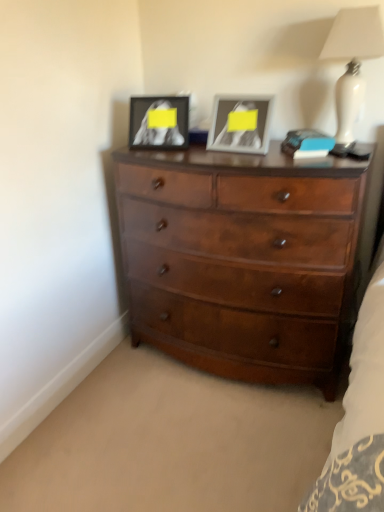
Question: Is matte black picture frame at upper center, placed as the second picture frame when sorted from right to left, to the left of blue matte book at upper right from the viewer's perspective?

Choices:
 (A) no
 (B) yes

Answer: (B)

Question: Can you confirm if matte black picture frame at upper center, placed as the second picture frame when sorted from right to left, is thinner than blue matte book at upper right?

Choices:
 (A) no
 (B) yes

Answer: (B)

Question: Is matte black picture frame at upper center, the 1th picture frame viewed from the left, positioned beyond the bounds of blue matte book at upper right?

Choices:
 (A) no
 (B) yes

Answer: (B)

Question: Can you confirm if matte black picture frame at upper center, the 1th picture frame viewed from the left, is positioned to the right of blue matte book at upper right?

Choices:
 (A) yes
 (B) no

Answer: (B)

Question: Can you confirm if matte black picture frame at upper center, the 1th picture frame viewed from the left, is smaller than blue matte book at upper right?

Choices:
 (A) no
 (B) yes

Answer: (A)

Question: From the image's perspective, is matte black picture frame at upper center, placed as the second picture frame when sorted from right to left, under blue matte book at upper right?

Choices:
 (A) yes
 (B) no

Answer: (B)

Question: Is blue matte book at upper right at the right side of white glossy lamp at upper right?

Choices:
 (A) yes
 (B) no

Answer: (B)

Question: Would you say blue matte book at upper right contains white glossy lamp at upper right?

Choices:
 (A) yes
 (B) no

Answer: (B)

Question: Considering the relative positions of blue matte book at upper right and white glossy lamp at upper right in the image provided, is blue matte book at upper right to the left of white glossy lamp at upper right from the viewer's perspective?

Choices:
 (A) yes
 (B) no

Answer: (A)

Question: Is blue matte book at upper right taller than white glossy lamp at upper right?

Choices:
 (A) no
 (B) yes

Answer: (A)

Question: Does blue matte book at upper right have a greater width compared to white glossy lamp at upper right?

Choices:
 (A) no
 (B) yes

Answer: (A)

Question: Considering the relative sizes of blue matte book at upper right and white glossy lamp at upper right in the image provided, is blue matte book at upper right thinner than white glossy lamp at upper right?

Choices:
 (A) yes
 (B) no

Answer: (A)

Question: Is matte black picture frame at upper center, placed as the second picture frame when sorted from right to left, positioned with its back to white glossy lamp at upper right?

Choices:
 (A) no
 (B) yes

Answer: (A)